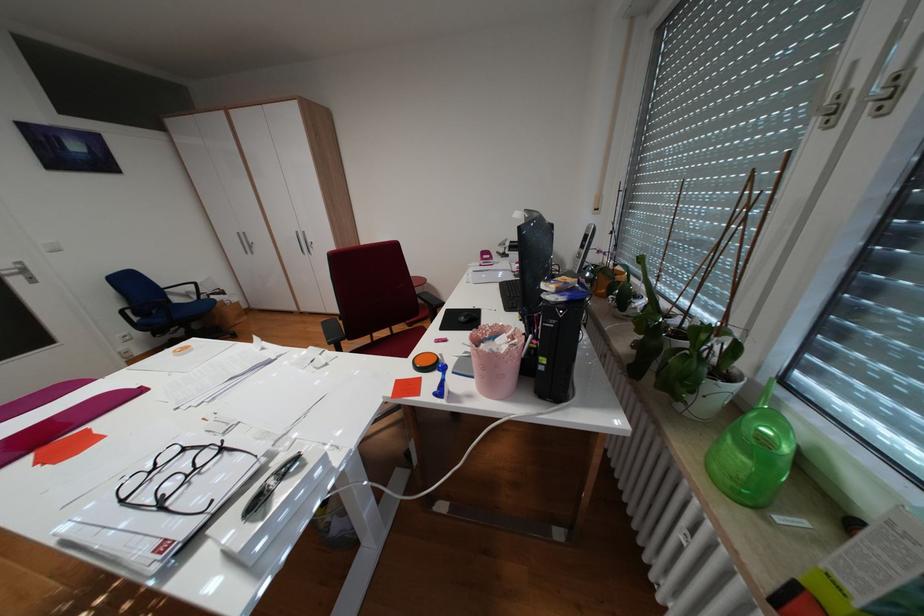
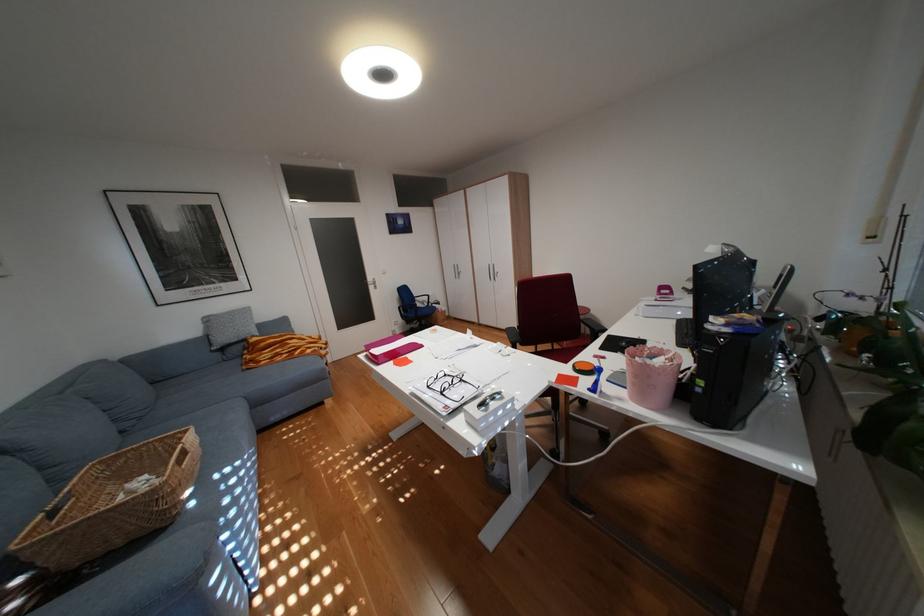
Locate, in the second image, the point that corresponds to point 173,505 in the first image.

(454, 392)